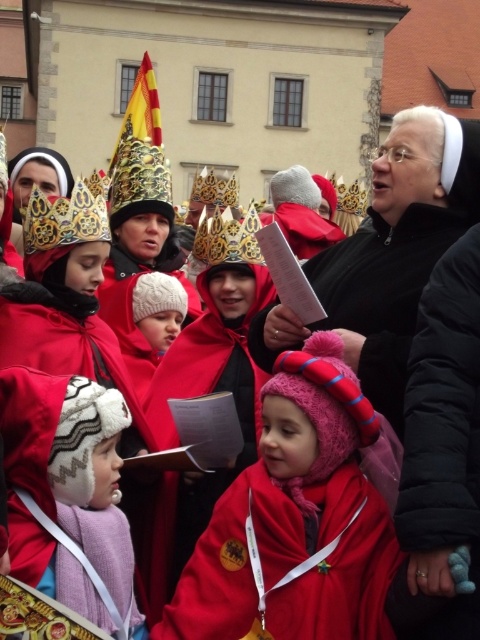
You are a photographer trying to capture a group photo of the fuzzy pink hat at center and the fuzzy white hat at lower left. Given that your camera has a maximum focus range of 6 meters, will you be able to fit both subjects into the frame without moving closer?

The fuzzy pink hat at center and the fuzzy white hat at lower left are 6.21 meters apart, which exceeds the camera maximum focus range of 6 meters. Therefore, you cannot fit both subjects into the frame without moving closer.

You are a photographer standing at the back of the group. You want to take a photo that includes both the fuzzy pink hat at center and the gold metallic crown at upper left. Given that your camera has a maximum focus range of 12 meters, will you be able to capture both objects clearly in the same frame?

The distance between the fuzzy pink hat at center and the gold metallic crown at upper left is 13.13 meters, which exceeds the camera maximum focus range of 12 meters. Therefore, you cannot capture both objects clearly in the same frame.